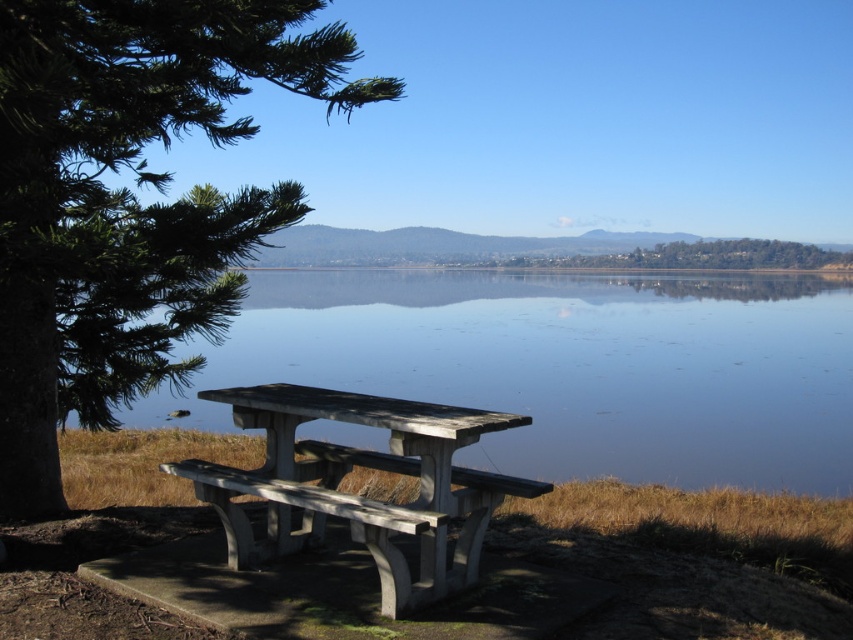
Between point (737, 436) and point (251, 193), which one is positioned in front?

Point (251, 193) is more forward.

Is point (714, 433) positioned behind point (71, 22)?

Yes, point (714, 433) is farther from viewer.

Find the location of a particular element. smooth blue water at center is located at coordinates (567, 368).

Can you confirm if green textured tree at left is smaller than gray concrete picnic table at lower left?

Yes.

Who is positioned more to the right, green textured tree at left or gray concrete picnic table at lower left?

Positioned to the right is gray concrete picnic table at lower left.

Who is more distant from viewer, (202, 12) or (300, 541)?

The point (300, 541) is behind.

Image resolution: width=853 pixels, height=640 pixels. What are the coordinates of `green textured tree at left` in the screenshot? It's located at (129, 198).

Can you confirm if smooth blue water at center is positioned below gray concrete picnic table at lower left?

Actually, smooth blue water at center is above gray concrete picnic table at lower left.

Does smooth blue water at center have a smaller size compared to gray concrete picnic table at lower left?

Incorrect, smooth blue water at center is not smaller in size than gray concrete picnic table at lower left.

Is point (434, 365) behind point (431, 582)?

Yes, it is.

This screenshot has width=853, height=640. Identify the location of smooth blue water at center. (567, 368).